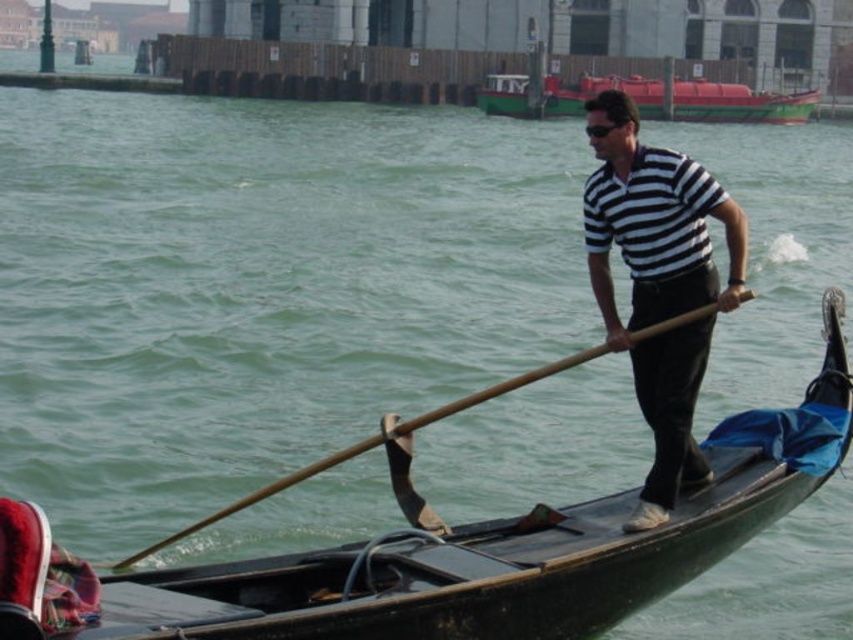
Between striped cotton shirt at center and green matte boat at upper center, which one is positioned lower?

striped cotton shirt at center is lower down.

What do you see at coordinates (659, 284) in the screenshot? I see `striped cotton shirt at center` at bounding box center [659, 284].

Describe the element at coordinates (659, 284) in the screenshot. I see `striped cotton shirt at center` at that location.

Image resolution: width=853 pixels, height=640 pixels. Identify the location of striped cotton shirt at center. (659, 284).

Does green matte boat at upper center come in front of wooden at right?

No.

Can you confirm if green matte boat at upper center is smaller than wooden at right?

No.

Who is more forward, (753, 90) or (459, 408)?

Point (459, 408) is more forward.

Identify the location of green matte boat at upper center. Image resolution: width=853 pixels, height=640 pixels. click(x=738, y=104).

Can you confirm if striped cotton shirt at center is thinner than wooden at right?

Yes, striped cotton shirt at center is thinner than wooden at right.

Does point (607, 120) lie in front of point (751, 292)?

That is False.

This screenshot has width=853, height=640. In order to click on striped cotton shirt at center in this screenshot , I will do `click(659, 284)`.